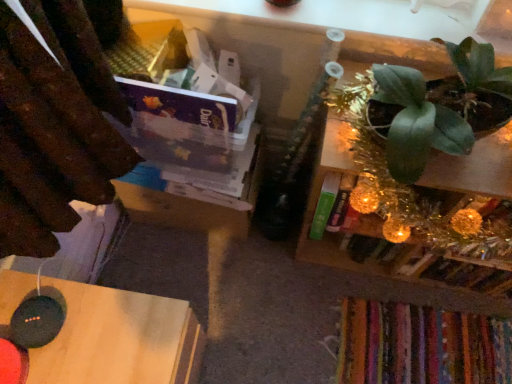
Measure the distance between point (73,296) and camera.

Point (73,296) is 33.98 inches away from camera.

The width and height of the screenshot is (512, 384). Describe the element at coordinates (118, 338) in the screenshot. I see `black wood table at lower left` at that location.

This screenshot has width=512, height=384. I want to click on green metallic plant at upper right, so click(420, 190).

You are a GUI agent. You are given a task and a screenshot of the screen. Output one action in this format:
    pyautogui.click(x=<x>, y=<y>)
    Task: Click on the green matte plant at upper right
    Image resolution: width=512 pixels, height=384 pixels.
    Given the screenshot: What is the action you would take?
    pyautogui.click(x=426, y=109)

Find the location of a particular element. houseplant located above the black wood table at lower left (from the image's perspective) is located at coordinates (426, 109).

Considering the sizes of objects black wood table at lower left and green matte plant at upper right in the image provided, who is bigger, black wood table at lower left or green matte plant at upper right?

black wood table at lower left is bigger.

From the image's perspective, is black wood table at lower left located beneath green matte plant at upper right?

Yes, from the image's perspective, black wood table at lower left is below green matte plant at upper right.

In terms of height, does black wood table at lower left look taller or shorter compared to green metallic plant at upper right?

black wood table at lower left is shorter than green metallic plant at upper right.

From a real-world perspective, is black wood table at lower left above or below green metallic plant at upper right?

From a real-world perspective, black wood table at lower left is physically below green metallic plant at upper right.

Does black wood table at lower left touch green metallic plant at upper right?

No, black wood table at lower left is not next to green metallic plant at upper right.

How many degrees apart are the facing directions of black wood table at lower left and green metallic plant at upper right?

There is a 90.3-degree angle between the facing directions of black wood table at lower left and green metallic plant at upper right.

Is green matte plant at upper right at the left side of black wood table at lower left?

No.

Locate an element on the screen. The width and height of the screenshot is (512, 384). table below the green matte plant at upper right (from a real-world perspective) is located at coordinates (118, 338).

Considering the points (421, 128) and (136, 375), which point is in front, point (421, 128) or point (136, 375)?

The point (421, 128) is closer.

From the image's perspective, which is above, green matte plant at upper right or black wood table at lower left?

green matte plant at upper right, from the image's perspective.

Considering the sizes of objects green metallic plant at upper right and green matte plant at upper right in the image provided, who is wider, green metallic plant at upper right or green matte plant at upper right?

green matte plant at upper right is wider.

In the image, is green metallic plant at upper right positioned in front of or behind green matte plant at upper right?

Visually, green metallic plant at upper right is located behind green matte plant at upper right.

Visually, is green metallic plant at upper right positioned to the left or to the right of green matte plant at upper right?

green metallic plant at upper right is to the right of green matte plant at upper right.

How many degrees apart are the facing directions of green metallic plant at upper right and green matte plant at upper right?

The angle between the facing direction of green metallic plant at upper right and the facing direction of green matte plant at upper right is 0.89 degrees.

Measure the distance between green metallic plant at upper right and black wood table at lower left.

They are 21.65 inches apart.

Locate an element on the screen. Image resolution: width=512 pixels, height=384 pixels. table below the green metallic plant at upper right (from the image's perspective) is located at coordinates (118, 338).

Does green metallic plant at upper right turn towards black wood table at lower left?

No, green metallic plant at upper right does not turn towards black wood table at lower left.

Is green metallic plant at upper right at the right side of black wood table at lower left?

Yes, green metallic plant at upper right is to the right of black wood table at lower left.

Is green matte plant at upper right not close to green metallic plant at upper right?

green matte plant at upper right is near green metallic plant at upper right, not far away.

Locate an element on the screen. The image size is (512, 384). shelf below the green matte plant at upper right (from a real-world perspective) is located at coordinates (420, 190).

From the image's perspective, which one is positioned higher, green matte plant at upper right or green metallic plant at upper right?

green matte plant at upper right appears higher in the image.

In the image, is green matte plant at upper right positioned in front of or behind green metallic plant at upper right?

Clearly, green matte plant at upper right is in front of green metallic plant at upper right.

Locate an element on the screen. The width and height of the screenshot is (512, 384). table behind the green matte plant at upper right is located at coordinates (118, 338).

The height and width of the screenshot is (384, 512). I want to click on table that is in front of the green metallic plant at upper right, so click(x=118, y=338).

Based on their spatial positions, is green matte plant at upper right or green metallic plant at upper right further from black wood table at lower left?

The object further to black wood table at lower left is green matte plant at upper right.

From the image, which object appears to be nearer to green metallic plant at upper right, green matte plant at upper right or black wood table at lower left?

Among the two, green matte plant at upper right is located nearer to green metallic plant at upper right.

When comparing their distances from black wood table at lower left, does green metallic plant at upper right or green matte plant at upper right seem closer?

The object closer to black wood table at lower left is green metallic plant at upper right.

Based on the photo, from the image, which object appears to be nearer to green metallic plant at upper right, black wood table at lower left or green matte plant at upper right?

green matte plant at upper right is positioned closer to the anchor green metallic plant at upper right.

Looking at this image, based on their spatial positions, is black wood table at lower left or green metallic plant at upper right further from green matte plant at upper right?

black wood table at lower left is positioned further to the anchor green matte plant at upper right.

Based on their spatial positions, is green metallic plant at upper right or black wood table at lower left further from green matte plant at upper right?

black wood table at lower left.

Find the location of a particular element. This screenshot has height=384, width=512. houseplant between black wood table at lower left and green metallic plant at upper right in the horizontal direction is located at coordinates [x=426, y=109].